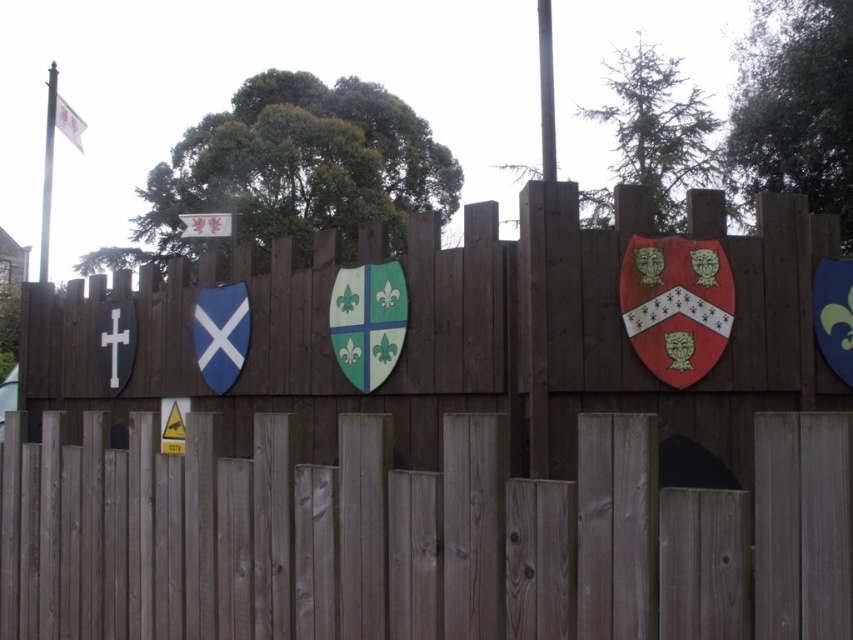
Is point (335, 284) positioned before point (548, 22)?

Yes, point (335, 284) is closer to viewer.

Consider the image. Which is more to the right, green matte shield at center or silver metallic pole at center?

silver metallic pole at center

Which is behind, point (386, 333) or point (538, 26)?

Positioned behind is point (538, 26).

Locate an element on the screen. The width and height of the screenshot is (853, 640). green matte shield at center is located at coordinates (368, 321).

Is red glossy shield at center wider than green matte shield at center?

Indeed, red glossy shield at center has a greater width compared to green matte shield at center.

Which is below, red glossy shield at center or green matte shield at center?

green matte shield at center is lower down.

What do you see at coordinates (676, 305) in the screenshot? This screenshot has height=640, width=853. I see `red glossy shield at center` at bounding box center [676, 305].

Find the location of a particular element. The width and height of the screenshot is (853, 640). red glossy shield at center is located at coordinates (676, 305).

Does brown wooden fence at center come in front of green matte shield at center?

Yes, it is.

Who is higher up, brown wooden fence at center or green matte shield at center?

green matte shield at center

This screenshot has height=640, width=853. Find the location of `brown wooden fence at center`. brown wooden fence at center is located at coordinates (437, 456).